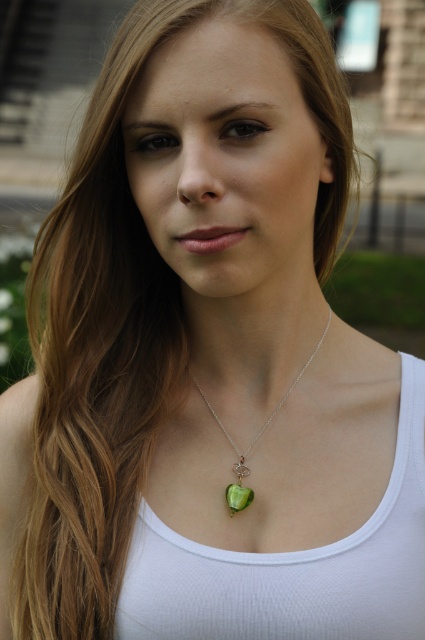
You are a photographer adjusting the lighting for a portrait. You notice two pendants on the subject wearing a white tank top. Which pendant, the green glass pendant at center or the green gemstone pendant at center, is positioned to the right of the other?

The green glass pendant at center is positioned to the right of the green gemstone pendant at center.

You are a photographer who wants to add a gold chain to the necklace in the image. The chain should be placed exactly where the green glass pendant at center currently is. What coordinate should you use to position the new gold chain?

The green glass pendant at center is located at coordinate point (252, 442), so you should position the new gold chain at the same coordinate point (252, 442).